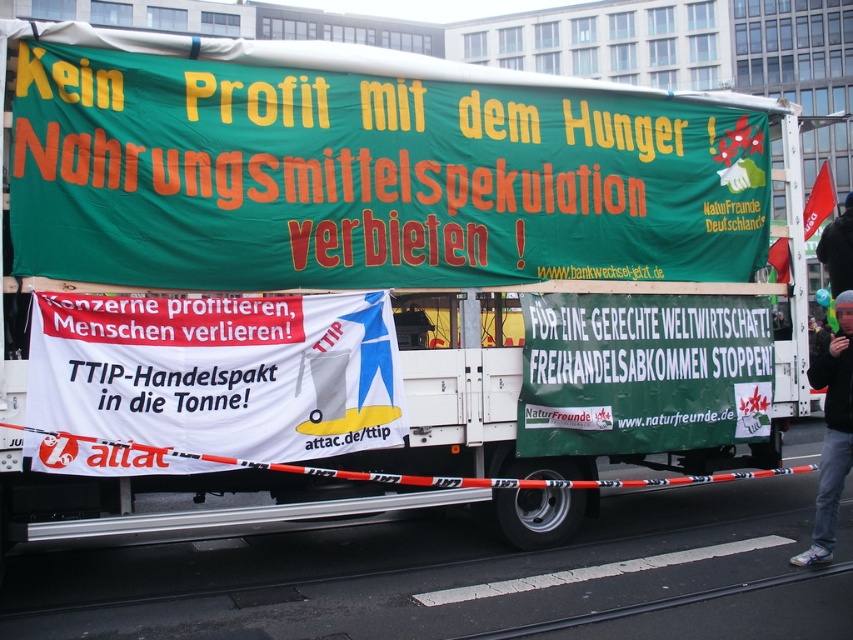
Can you confirm if white paper banner at center is smaller than green fabric banner at center?

Yes.

This screenshot has height=640, width=853. Describe the element at coordinates (209, 380) in the screenshot. I see `white paper banner at center` at that location.

Where is `white paper banner at center`? This screenshot has width=853, height=640. white paper banner at center is located at coordinates (209, 380).

Is point (20, 148) behind point (527, 406)?

No, (20, 148) is closer to viewer.

Based on the photo, does green fabric banner at upper center have a lesser height compared to green fabric banner at center?

In fact, green fabric banner at upper center may be taller than green fabric banner at center.

At what (x,y) coordinates should I click in order to perform the action: click on green fabric banner at upper center. Please return your answer as a coordinate pair (x, y). The image size is (853, 640). Looking at the image, I should click on (368, 177).

Between green fabric banner at upper center and black jacket at lower right, which one has less height?

Standing shorter between the two is green fabric banner at upper center.

Does green fabric banner at upper center have a greater height compared to black jacket at lower right?

Incorrect, green fabric banner at upper center's height is not larger of black jacket at lower right's.

Is point (672, 227) positioned behind point (831, 536)?

That is True.

In order to click on green fabric banner at upper center in this screenshot , I will do `click(368, 177)`.